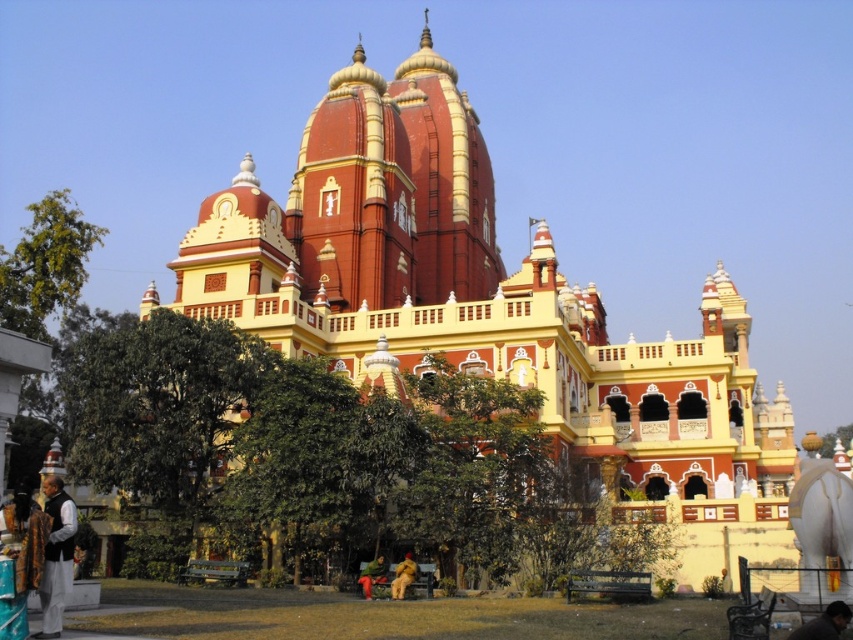
Is brown fabric jacket at lower right positioned behind green fabric cloth at lower center?

No.

The image size is (853, 640). Describe the element at coordinates (824, 624) in the screenshot. I see `brown fabric jacket at lower right` at that location.

Between point (799, 628) and point (383, 561), which one is positioned in front?

Positioned in front is point (799, 628).

Identify the location of brown fabric jacket at lower right. (824, 624).

Does dark brown fabric at lower left lie in front of green fabric cloth at lower center?

Yes, it is.

Can you confirm if dark brown fabric at lower left is smaller than green fabric cloth at lower center?

Yes, dark brown fabric at lower left is smaller than green fabric cloth at lower center.

Who is more distant from viewer, [50,545] or [364,580]?

The point [364,580] is behind.

Find the location of a particular element. The image size is (853, 640). dark brown fabric at lower left is located at coordinates (56, 557).

Is brown fabric jacket at lower right below golden fabric person at lower center?

No.

Is brown fabric jacket at lower right to the right of golden fabric person at lower center from the viewer's perspective?

Correct, you'll find brown fabric jacket at lower right to the right of golden fabric person at lower center.

At what (x,y) coordinates should I click in order to perform the action: click on brown fabric jacket at lower right. Please return your answer as a coordinate pair (x, y). The image size is (853, 640). Looking at the image, I should click on (824, 624).